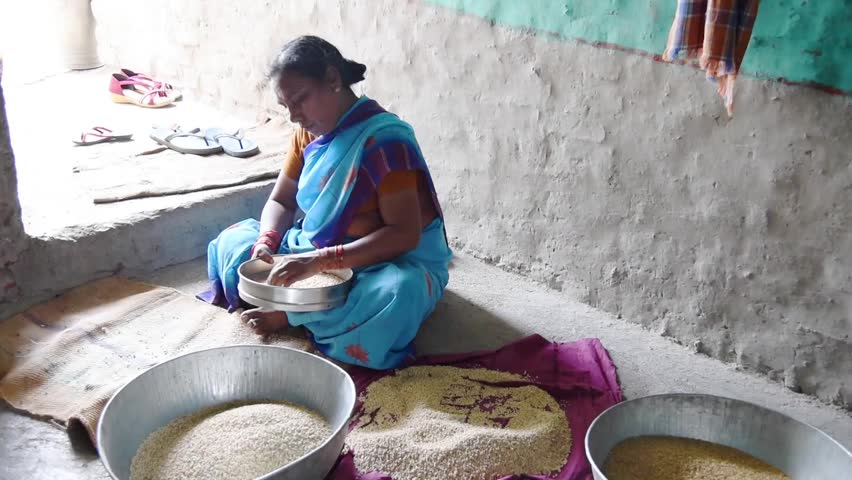
The width and height of the screenshot is (852, 480). In order to click on opening entryway in this screenshot , I will do `click(53, 79)`.